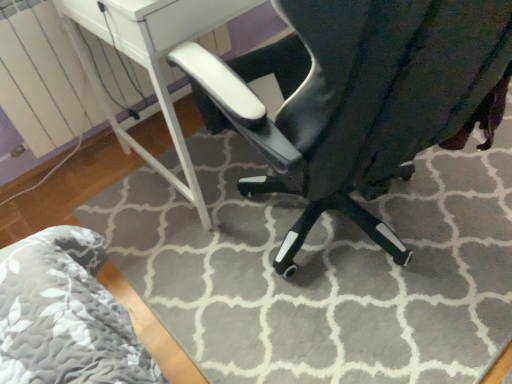
Locate an element on the screen. This screenshot has width=512, height=384. free point to the left of glossy black chair at center is located at coordinates (172, 261).